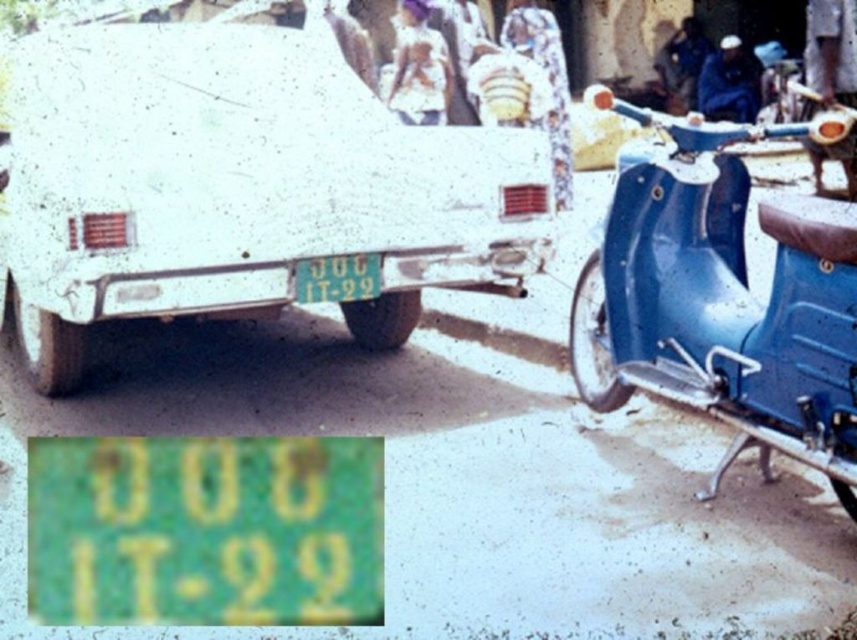
Is white matte car at center above green matte license plate at center?

Yes, white matte car at center is above green matte license plate at center.

What do you see at coordinates (240, 184) in the screenshot?
I see `white matte car at center` at bounding box center [240, 184].

Describe the element at coordinates (240, 184) in the screenshot. I see `white matte car at center` at that location.

Locate an element on the screen. white matte car at center is located at coordinates (240, 184).